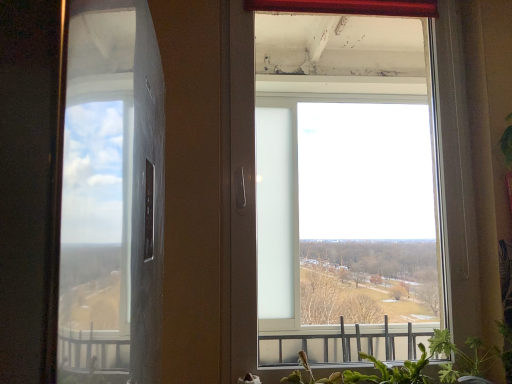
Question: Is green leafy plant at lower right, which is counted as the second plant, starting from the left, completely or partially outside of transparent glass window at center?

Choices:
 (A) no
 (B) yes

Answer: (B)

Question: Is green leafy plant at lower right, which is counted as the second plant, starting from the left, positioned before transparent glass window at center?

Choices:
 (A) yes
 (B) no

Answer: (A)

Question: Can you confirm if green leafy plant at lower right, which is counted as the second plant, starting from the left, is positioned to the left of transparent glass window at center?

Choices:
 (A) no
 (B) yes

Answer: (A)

Question: From the image's perspective, would you say green leafy plant at lower right, which is counted as the second plant, starting from the left, is shown under transparent glass window at center?

Choices:
 (A) no
 (B) yes

Answer: (B)

Question: From a real-world perspective, is green leafy plant at lower right, which is counted as the second plant, starting from the left, physically below transparent glass window at center?

Choices:
 (A) no
 (B) yes

Answer: (B)

Question: From the image's perspective, is green leafy plant at lower right, which is counted as the second plant, starting from the left, over transparent glass window at center?

Choices:
 (A) yes
 (B) no

Answer: (B)

Question: Is transparent glass window at center thinner than green leafy plant at lower right, arranged as the 1th plant when viewed from the right?

Choices:
 (A) yes
 (B) no

Answer: (A)

Question: Is transparent glass window at center at the right side of green leafy plant at lower right, arranged as the 1th plant when viewed from the right?

Choices:
 (A) no
 (B) yes

Answer: (A)

Question: Considering the relative sizes of transparent glass window at center and green leafy plant at lower right, which is counted as the second plant, starting from the left, in the image provided, is transparent glass window at center smaller than green leafy plant at lower right, which is counted as the second plant, starting from the left,?

Choices:
 (A) yes
 (B) no

Answer: (B)

Question: Is transparent glass window at center not close to green leafy plant at lower right, which is counted as the second plant, starting from the left?

Choices:
 (A) yes
 (B) no

Answer: (A)

Question: Is transparent glass window at center oriented towards green leafy plant at lower right, arranged as the 1th plant when viewed from the right?

Choices:
 (A) yes
 (B) no

Answer: (A)

Question: Does transparent glass window at center come in front of green leafy plant at lower right, arranged as the 1th plant when viewed from the right?

Choices:
 (A) yes
 (B) no

Answer: (B)

Question: Is green leafy plant at lower right, acting as the 2th plant starting from the right, not near transparent glass window at center?

Choices:
 (A) yes
 (B) no

Answer: (A)